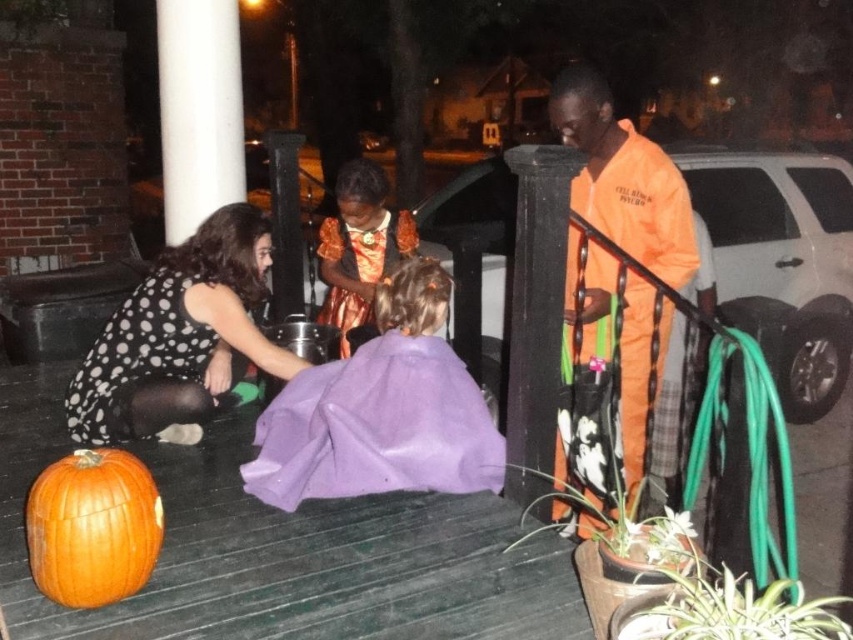
Question: Does black dotted dress at lower left come in front of orange matte pumpkin at lower left?

Choices:
 (A) no
 (B) yes

Answer: (A)

Question: Which object appears closest to the camera in this image?

Choices:
 (A) purple satin dress at center
 (B) black dotted dress at lower left
 (C) orange satin dress at center
 (D) orange matte pumpkin at lower left

Answer: (D)

Question: Is the position of orange matte pumpkin at lower left less distant than that of orange satin dress at center?

Choices:
 (A) no
 (B) yes

Answer: (B)

Question: Estimate the real-world distances between objects in this image. Which object is closer to the black dotted dress at lower left?

Choices:
 (A) orange jumpsuit at right
 (B) purple satin dress at center
 (C) orange matte pumpkin at lower left
 (D) orange satin dress at center

Answer: (B)

Question: Can you confirm if purple satin dress at center is thinner than orange satin dress at center?

Choices:
 (A) yes
 (B) no

Answer: (B)

Question: Among these points, which one is nearest to the camera?

Choices:
 (A) (585, 316)
 (B) (97, 435)
 (C) (90, 509)

Answer: (C)